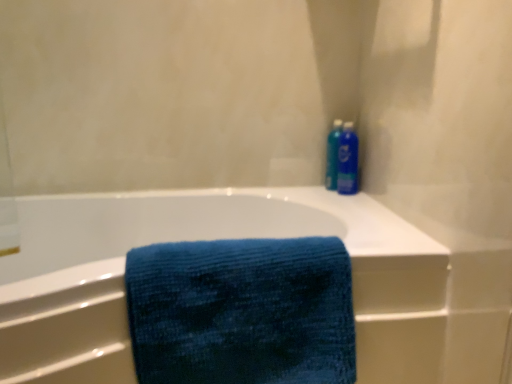
Question: Is blue fabric towel at center taller or shorter than blue glossy spray can at upper right?

Choices:
 (A) short
 (B) tall

Answer: (B)

Question: In the image, is blue fabric towel at center positioned in front of or behind blue glossy spray can at upper right?

Choices:
 (A) front
 (B) behind

Answer: (A)

Question: Which object is the closest to the blue glossy spray can at upper right?

Choices:
 (A) blue fabric towel at center
 (B) blue textured towel at center
 (C) blue plastic bottle at upper right

Answer: (C)

Question: Estimate the real-world distances between objects in this image. Which object is closer to the blue plastic bottle at upper right?

Choices:
 (A) blue glossy spray can at upper right
 (B) blue textured towel at center
 (C) blue fabric towel at center

Answer: (A)